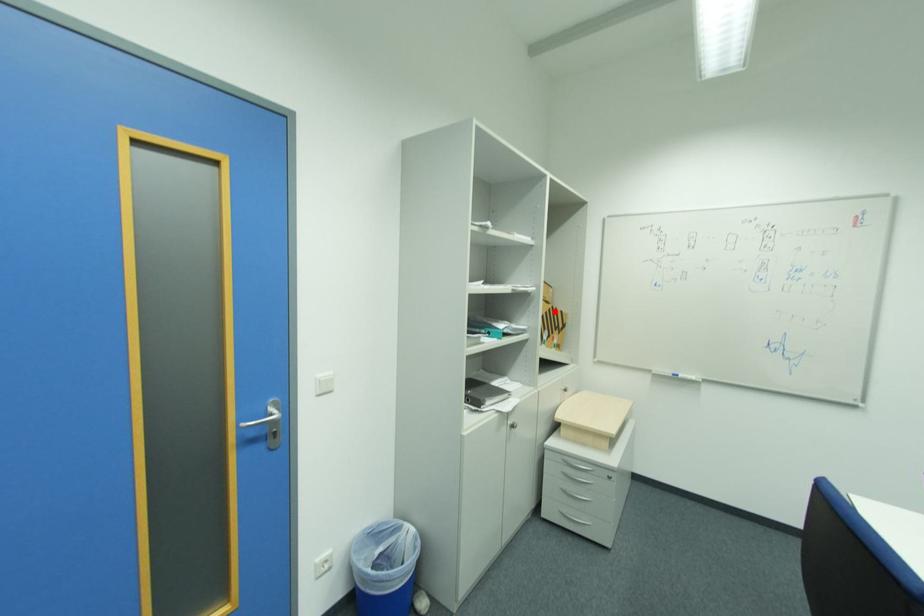
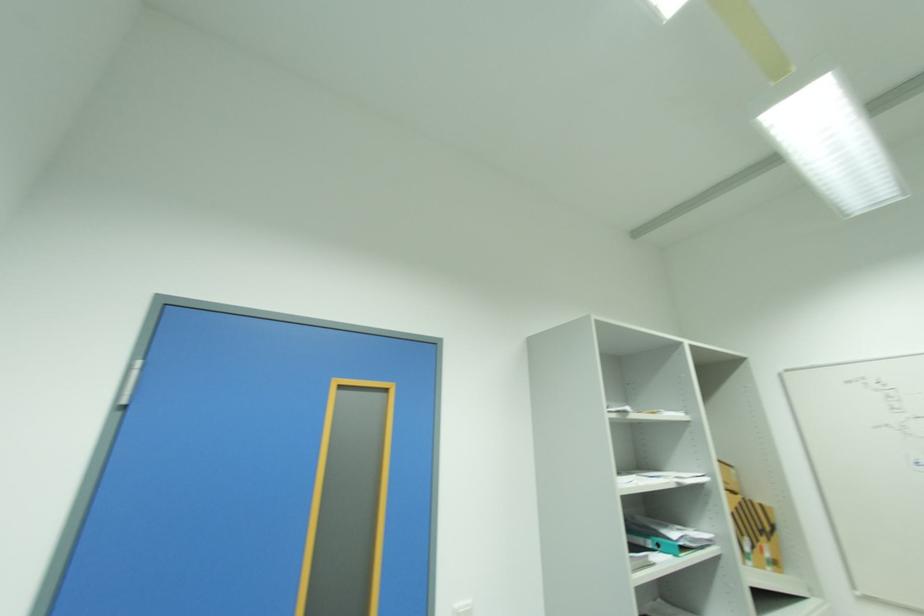
The point at the highlighted location is marked in the first image. Where is the corresponding point in the second image?

(746, 506)